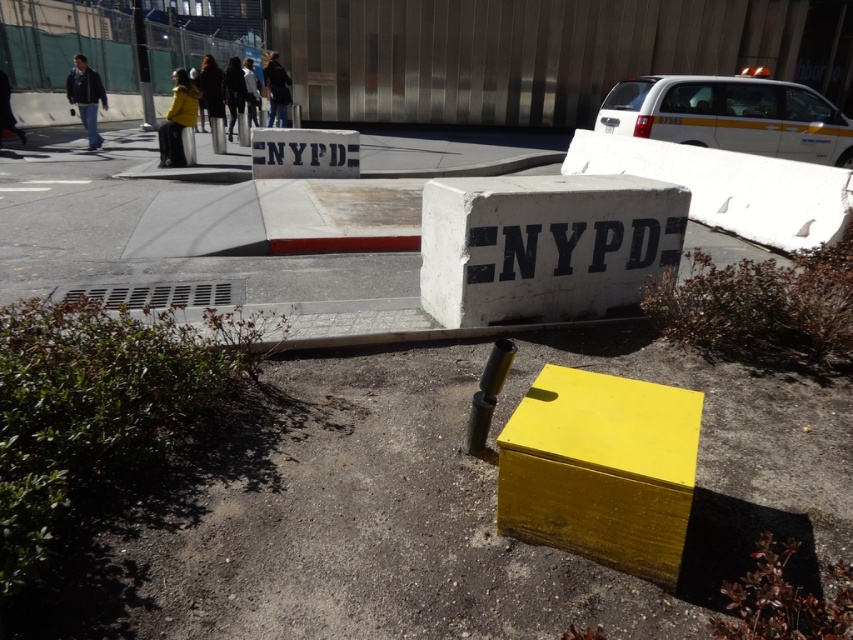
Question: Which of the following is the closest to the observer?

Choices:
 (A) yellow matte box at center
 (B) dark brown leather coat at upper center
 (C) dark blue jacket at upper left
 (D) yellow wool coat at upper center

Answer: (A)

Question: Observing the image, what is the correct spatial positioning of yellow matte jacket at upper left in reference to dark blue jacket at upper left?

Choices:
 (A) below
 (B) above

Answer: (A)

Question: Which object is the closest to the dark blue jacket at upper center?

Choices:
 (A) yellow wool coat at upper center
 (B) dark brown leather coat at upper center
 (C) yellow matte box at center

Answer: (A)

Question: Which object is closer to the camera taking this photo?

Choices:
 (A) yellow matte box at center
 (B) dark blue jacket at upper left
 (C) yellow wool coat at upper center

Answer: (A)

Question: Is yellow matte jacket at upper left thinner than yellow wool coat at upper center?

Choices:
 (A) no
 (B) yes

Answer: (A)

Question: Is dark brown leather coat at upper center closer to camera compared to yellow wool coat at upper center?

Choices:
 (A) yes
 (B) no

Answer: (A)